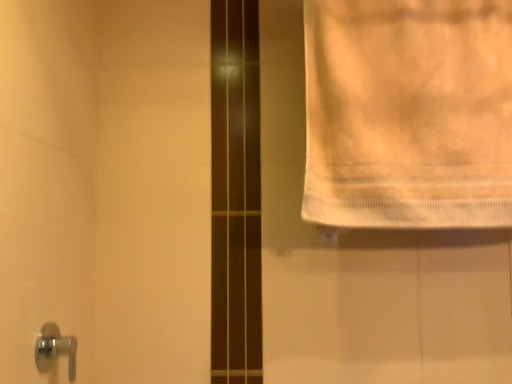
What do you see at coordinates (55, 349) in the screenshot? The height and width of the screenshot is (384, 512). I see `chrome metallic door handle at lower left` at bounding box center [55, 349].

Locate an element on the screen. This screenshot has height=384, width=512. chrome metallic door handle at lower left is located at coordinates (55, 349).

In order to click on white cotton towel at upper right in this screenshot , I will do `click(408, 113)`.

This screenshot has height=384, width=512. What do you see at coordinates (408, 113) in the screenshot?
I see `white cotton towel at upper right` at bounding box center [408, 113].

In order to face white cotton towel at upper right, should I rotate leftwards or rightwards?

You should rotate right by 20.285 degrees.

Measure the distance between point (330, 48) and camera.

3.46 feet.

Where is `chrome metallic door handle at lower left`? This screenshot has height=384, width=512. chrome metallic door handle at lower left is located at coordinates (55, 349).

Considering the positions of objects chrome metallic door handle at lower left and white cotton towel at upper right in the image provided, who is more to the left, chrome metallic door handle at lower left or white cotton towel at upper right?

Positioned to the left is chrome metallic door handle at lower left.

Does chrome metallic door handle at lower left come in front of white cotton towel at upper right?

Yes, it is in front of white cotton towel at upper right.

Considering the positions of point (46, 339) and point (430, 99), is point (46, 339) closer or farther from the camera than point (430, 99)?

Point (46, 339) appears to be closer to the viewer than point (430, 99).

From the image's perspective, is chrome metallic door handle at lower left over white cotton towel at upper right?

No.

From a real-world perspective, which object stands above the other?

white cotton towel at upper right is physically above.

Considering the sizes of chrome metallic door handle at lower left and white cotton towel at upper right in the image, is chrome metallic door handle at lower left wider or thinner than white cotton towel at upper right?

Clearly, chrome metallic door handle at lower left has less width compared to white cotton towel at upper right.

Considering the relative sizes of chrome metallic door handle at lower left and white cotton towel at upper right in the image provided, is chrome metallic door handle at lower left taller than white cotton towel at upper right?

No.

Which of these two, chrome metallic door handle at lower left or white cotton towel at upper right, is bigger?

With larger size is white cotton towel at upper right.

Can white cotton towel at upper right be found inside chrome metallic door handle at lower left?

That's incorrect, white cotton towel at upper right is not inside chrome metallic door handle at lower left.

Are chrome metallic door handle at lower left and white cotton towel at upper right far apart?

Actually, chrome metallic door handle at lower left and white cotton towel at upper right are a little close together.

Is chrome metallic door handle at lower left positioned with its back to white cotton towel at upper right?

No, chrome metallic door handle at lower left's orientation is not away from white cotton towel at upper right.

How many degrees apart are the facing directions of chrome metallic door handle at lower left and white cotton towel at upper right?

90 degrees.

Locate an element on the screen. door handle in front of the white cotton towel at upper right is located at coordinates (55, 349).

Does white cotton towel at upper right appear on the right side of chrome metallic door handle at lower left?

Yes.

Looking at this image, which is in front, white cotton towel at upper right or chrome metallic door handle at lower left?

chrome metallic door handle at lower left is more forward.

Does point (322, 83) come closer to viewer compared to point (50, 326)?

No, (322, 83) is further to viewer.

From the image's perspective, is white cotton towel at upper right positioned above or below chrome metallic door handle at lower left?

Based on their image positions, white cotton towel at upper right is located above chrome metallic door handle at lower left.

From a real-world perspective, is white cotton towel at upper right on chrome metallic door handle at lower left?

Indeed, from a real-world perspective, white cotton towel at upper right stands above chrome metallic door handle at lower left.

Between white cotton towel at upper right and chrome metallic door handle at lower left, which one has larger width?

Wider between the two is white cotton towel at upper right.

Can you confirm if white cotton towel at upper right is taller than chrome metallic door handle at lower left?

Yes.

Can you confirm if white cotton towel at upper right is bigger than chrome metallic door handle at lower left?

Yes, white cotton towel at upper right is bigger than chrome metallic door handle at lower left.

Would you say white cotton towel at upper right is inside or outside chrome metallic door handle at lower left?

white cotton towel at upper right is located beyond the bounds of chrome metallic door handle at lower left.

Is white cotton towel at upper right beside chrome metallic door handle at lower left?

white cotton towel at upper right and chrome metallic door handle at lower left are clearly separated.

Is white cotton towel at upper right facing towards chrome metallic door handle at lower left?

No, white cotton towel at upper right is not aimed at chrome metallic door handle at lower left.

Where is `towel behind the chrome metallic door handle at lower left`? towel behind the chrome metallic door handle at lower left is located at coordinates (408, 113).

Identify the location of door handle on the left of white cotton towel at upper right. (55, 349).

Locate an element on the screen. towel above the chrome metallic door handle at lower left (from a real-world perspective) is located at coordinates (408, 113).